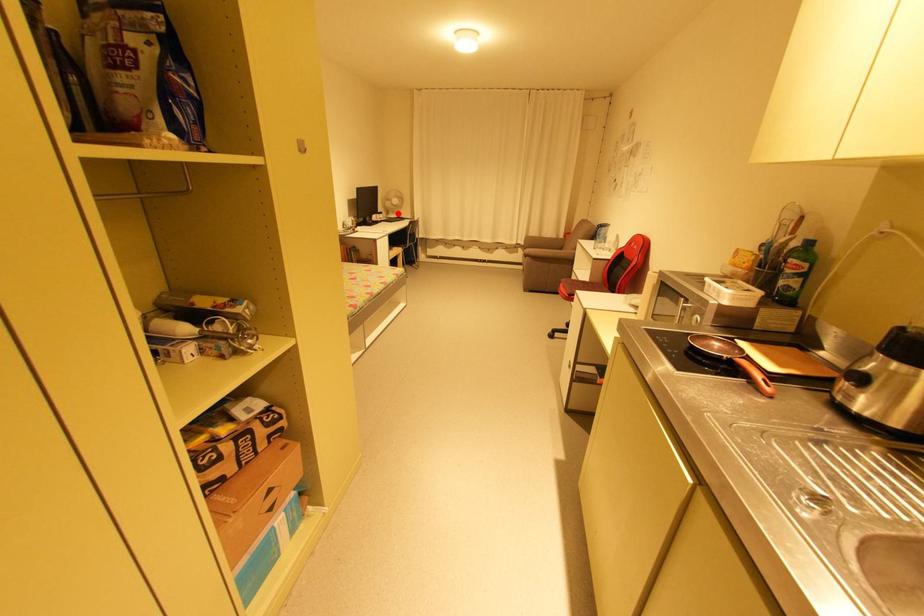
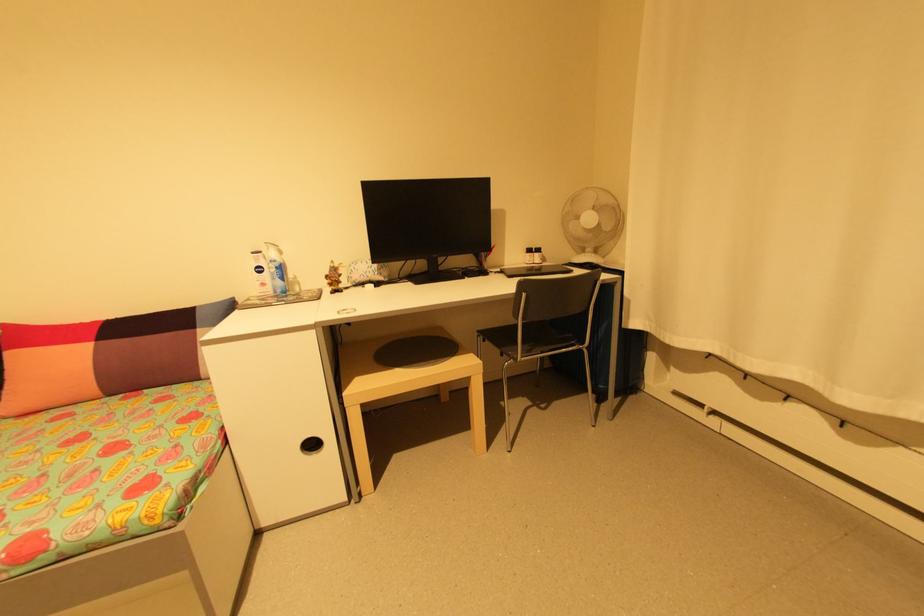
In the second image, find the point that corresponds to the highlighted location in the first image.

(600, 252)